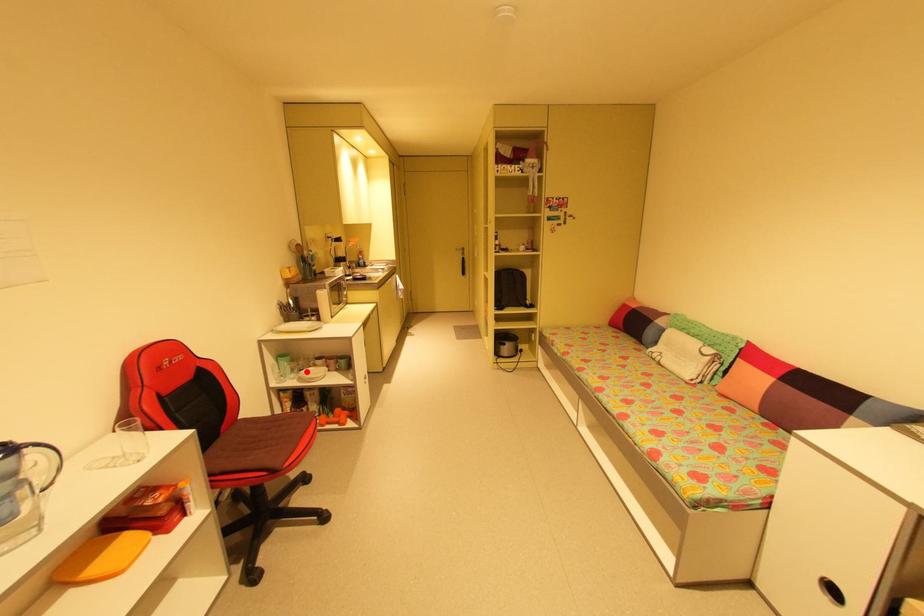
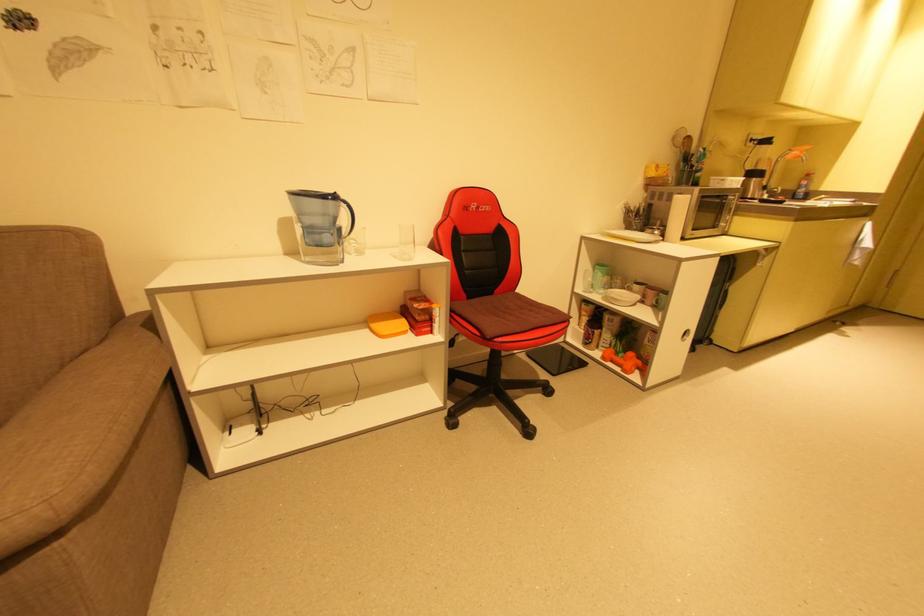
Where in the second image is the point corresponding to the highlighted location from the first image?

(616, 290)